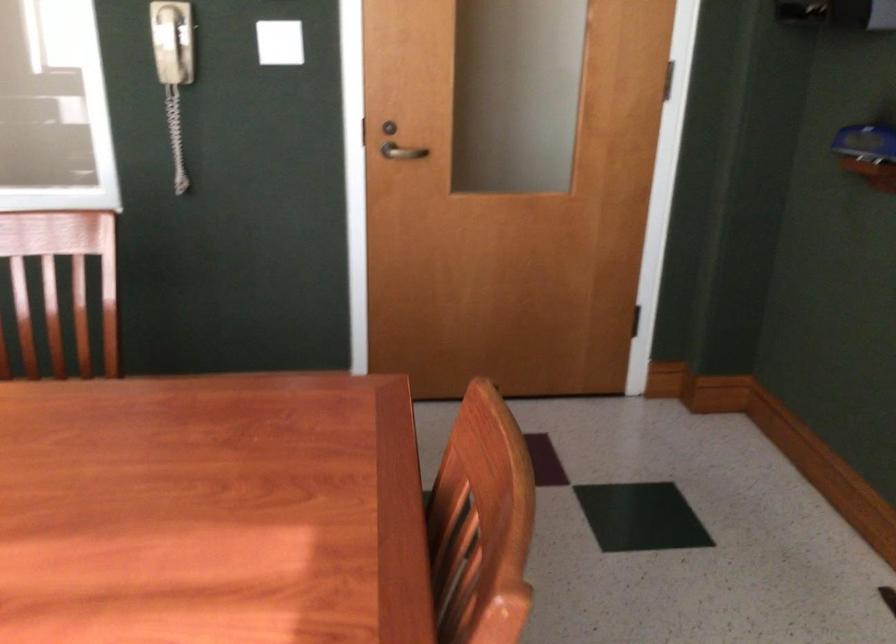
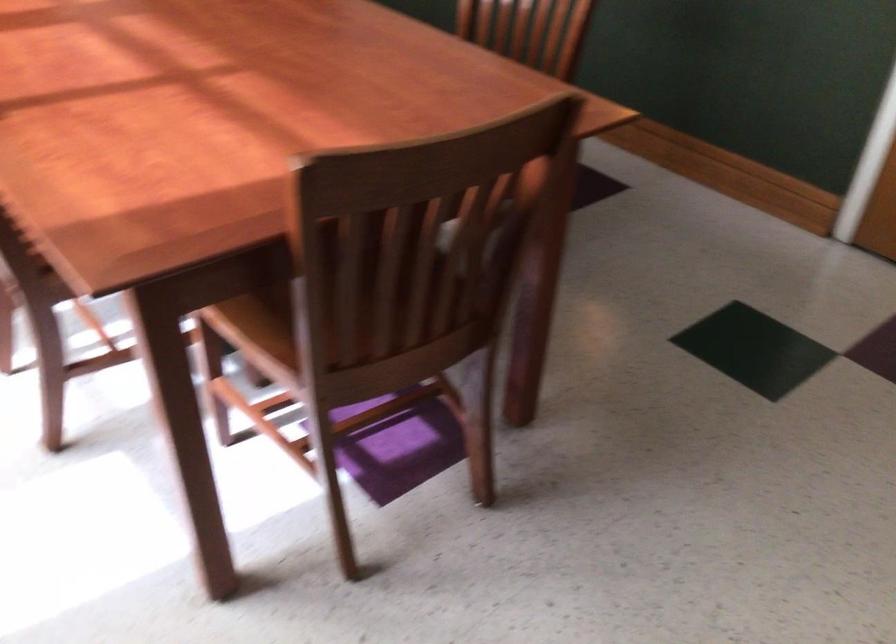
The first image is from the beginning of the video and the second image is from the end. How did the camera likely rotate when shooting the video?

The camera's rotation is toward left-down.